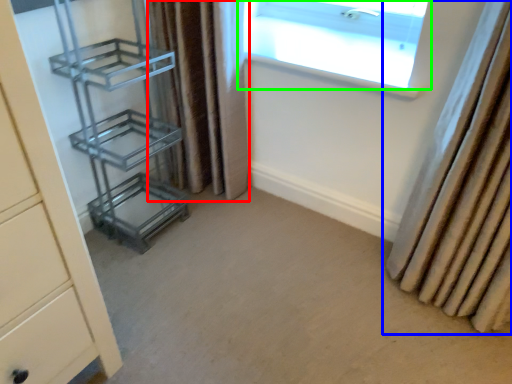
Question: Which object is the closest to the curtain (highlighted by a red box)? Choose among these: curtain (highlighted by a blue box) or window (highlighted by a green box).

Choices:
 (A) curtain
 (B) window

Answer: (B)